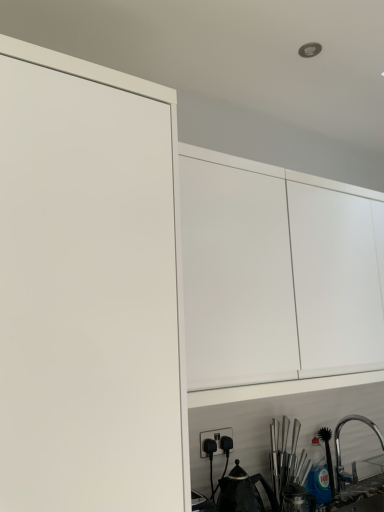
Question: From the image's perspective, is black plastic electric outlet at lower center on white matte cabinet at upper center?

Choices:
 (A) yes
 (B) no

Answer: (B)

Question: Considering the relative positions of black plastic electric outlet at lower center and white matte cabinet at upper center in the image provided, is black plastic electric outlet at lower center to the right of white matte cabinet at upper center from the viewer's perspective?

Choices:
 (A) no
 (B) yes

Answer: (A)

Question: From a real-world perspective, is black plastic electric outlet at lower center positioned over white matte cabinet at upper center based on gravity?

Choices:
 (A) yes
 (B) no

Answer: (B)

Question: Does black plastic electric outlet at lower center lie behind white matte cabinet at upper center?

Choices:
 (A) yes
 (B) no

Answer: (A)

Question: Does black plastic electric outlet at lower center have a lesser width compared to white matte cabinet at upper center?

Choices:
 (A) yes
 (B) no

Answer: (A)

Question: From a real-world perspective, is black plastic electric outlet at lower center under white matte cabinet at upper center?

Choices:
 (A) no
 (B) yes

Answer: (B)

Question: Is black matte tea pot at lower center facing towards black plastic electric outlet at lower center?

Choices:
 (A) yes
 (B) no

Answer: (B)

Question: Is black matte tea pot at lower center wider than black plastic electric outlet at lower center?

Choices:
 (A) yes
 (B) no

Answer: (A)

Question: Does black matte tea pot at lower center come behind black plastic electric outlet at lower center?

Choices:
 (A) no
 (B) yes

Answer: (A)

Question: From the image's perspective, is black matte tea pot at lower center under black plastic electric outlet at lower center?

Choices:
 (A) yes
 (B) no

Answer: (A)

Question: Can black plastic electric outlet at lower center be found inside black matte tea pot at lower center?

Choices:
 (A) yes
 (B) no

Answer: (B)

Question: Considering the relative sizes of black matte tea pot at lower center and black plastic electric outlet at lower center in the image provided, is black matte tea pot at lower center smaller than black plastic electric outlet at lower center?

Choices:
 (A) no
 (B) yes

Answer: (A)

Question: Is satin nickel faucet at lower right smaller than black plastic electric outlet at lower center?

Choices:
 (A) no
 (B) yes

Answer: (A)